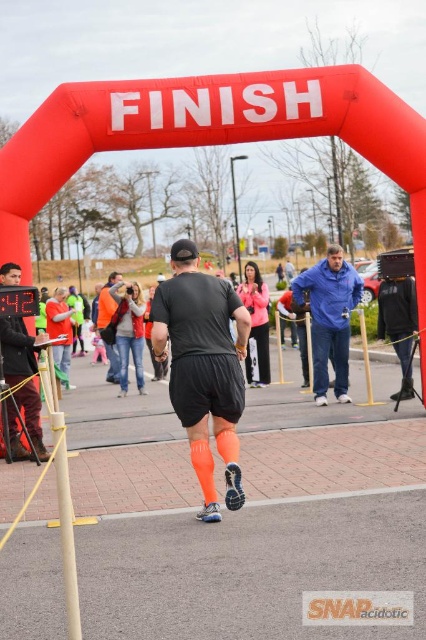
Is blue fleece jacket at center bigger than neon orange athletic socks at center?

Yes.

Between blue fleece jacket at center and neon orange athletic socks at center, which one appears on the left side from the viewer's perspective?

neon orange athletic socks at center

Does point (334, 308) lie in front of point (258, 301)?

Yes, point (334, 308) is closer to viewer.

This screenshot has width=426, height=640. Find the location of `blue fleece jacket at center`. blue fleece jacket at center is located at coordinates pos(328,317).

Does matte black shorts at center have a larger size compared to blue fleece jacket at center?

No, matte black shorts at center is not bigger than blue fleece jacket at center.

Looking at this image, which is more to the left, matte black shorts at center or blue fleece jacket at center?

matte black shorts at center

Who is more distant from viewer, (236, 508) or (296, 276)?

The point (296, 276) is behind.

This screenshot has height=640, width=426. I want to click on matte black shorts at center, so click(204, 368).

Does matte black timer at center have a smaller size compared to neon orange athletic socks at center?

Indeed, matte black timer at center has a smaller size compared to neon orange athletic socks at center.

Can you confirm if matte black timer at center is positioned below neon orange athletic socks at center?

Yes.

What do you see at coordinates (23, 374) in the screenshot? Image resolution: width=426 pixels, height=640 pixels. I see `matte black timer at center` at bounding box center [23, 374].

The image size is (426, 640). Identify the location of matte black timer at center. (23, 374).